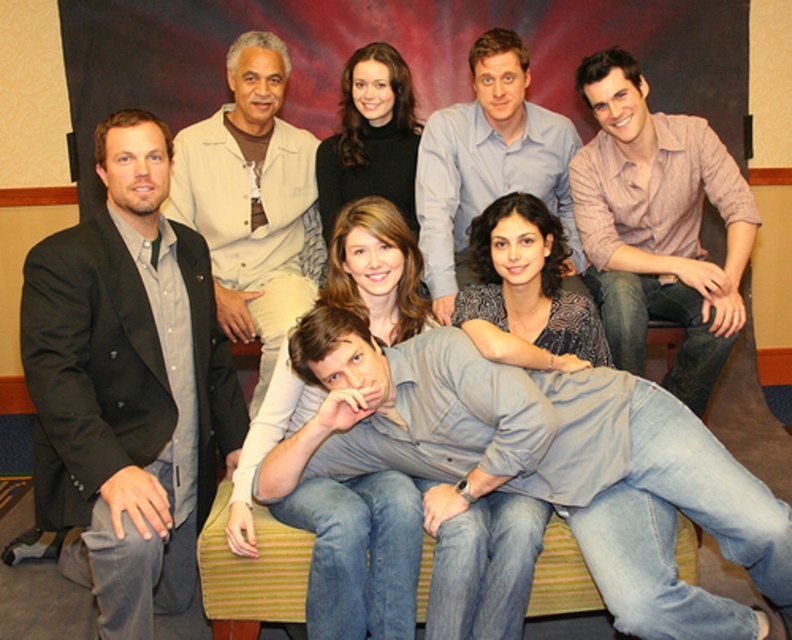
Which of these two, dark gray suit at left or denim jeans at lower right, stands shorter?

denim jeans at lower right is shorter.

Is dark gray suit at left positioned before denim jeans at lower right?

No, it is behind denim jeans at lower right.

Does point (185, 240) lie behind point (600, 344)?

No, (185, 240) is closer to viewer.

Locate an element on the screen. dark gray suit at left is located at coordinates (128, 385).

Measure the distance from pink striped shirt at upper right to light blue shirt at center.

The distance of pink striped shirt at upper right from light blue shirt at center is 12.11 inches.

Is point (684, 240) farther from camera compared to point (495, 148)?

No, (684, 240) is closer to viewer.

What do you see at coordinates (657, 225) in the screenshot? I see `pink striped shirt at upper right` at bounding box center [657, 225].

Locate an element on the screen. pink striped shirt at upper right is located at coordinates (657, 225).

Which is above, dark gray suit at left or pink striped shirt at upper right?

pink striped shirt at upper right is above.

Does dark gray suit at left have a larger size compared to pink striped shirt at upper right?

Correct, dark gray suit at left is larger in size than pink striped shirt at upper right.

Does point (143, 451) come farther from viewer compared to point (718, 339)?

That is False.

Where is `dark gray suit at left`? This screenshot has height=640, width=792. dark gray suit at left is located at coordinates pos(128,385).